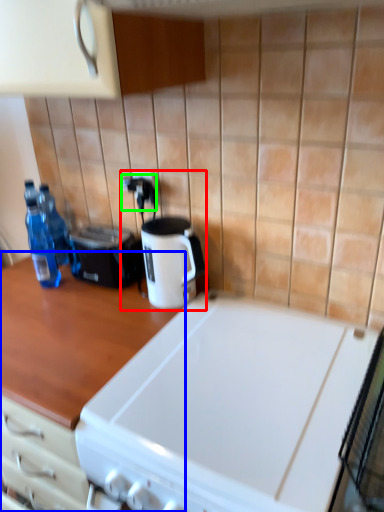
Question: Which object is positioned closest to coffee machine (highlighted by a red box)? Select from countertop (highlighted by a blue box) and electric outlet (highlighted by a green box).

Choices:
 (A) countertop
 (B) electric outlet

Answer: (B)